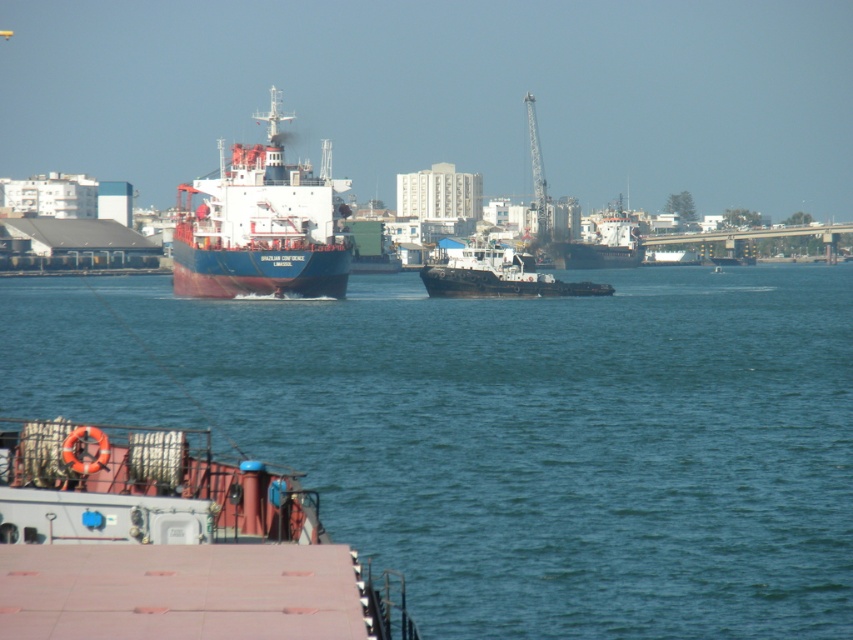
You are standing on the dock and want to reach the rustic metal barge at lower left. Which direction should you move relative to the blue water at center?

To reach the rustic metal barge at lower left, you should move away from the blue water at center since the barge is closer to the viewer than the water.